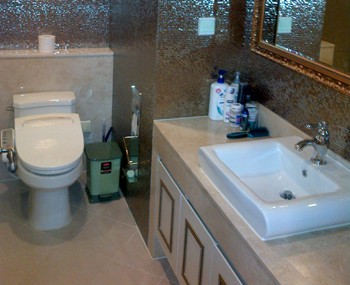
At what (x,y) coordinates should I click in order to perform the action: click on mirror. Please return your answer as a coordinate pair (x, y). Looking at the image, I should click on (315, 44).